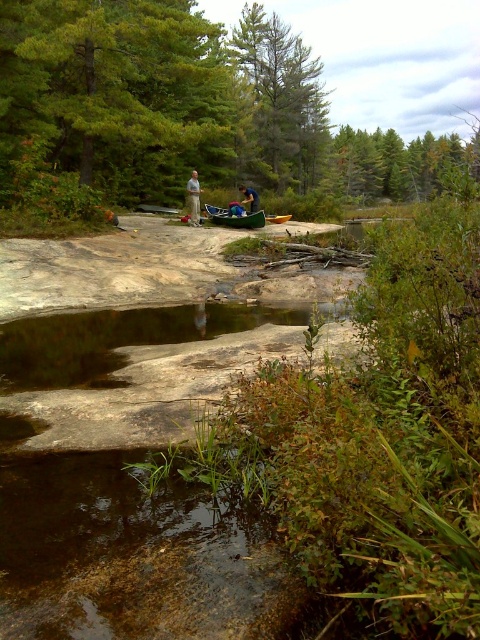
You are planning to take a photo of the green leafy tree at upper center and the yellow plastic canoe at center from the bank of the stream. Which object should you position closer to the camera to ensure both are in focus?

To ensure both the green leafy tree at upper center and the yellow plastic canoe at center are in focus, position the yellow plastic canoe at center closer to the camera since it is narrower than the green leafy tree at upper center, which might be wider.

You are planning to take a photo of the green matte tree at upper center and the green matte canoe at center from the left side of the stream. Which object will appear on the left side of your photo?

The green matte canoe at center will appear on the left side of the photo because the green matte tree at upper center is positioned to its right.